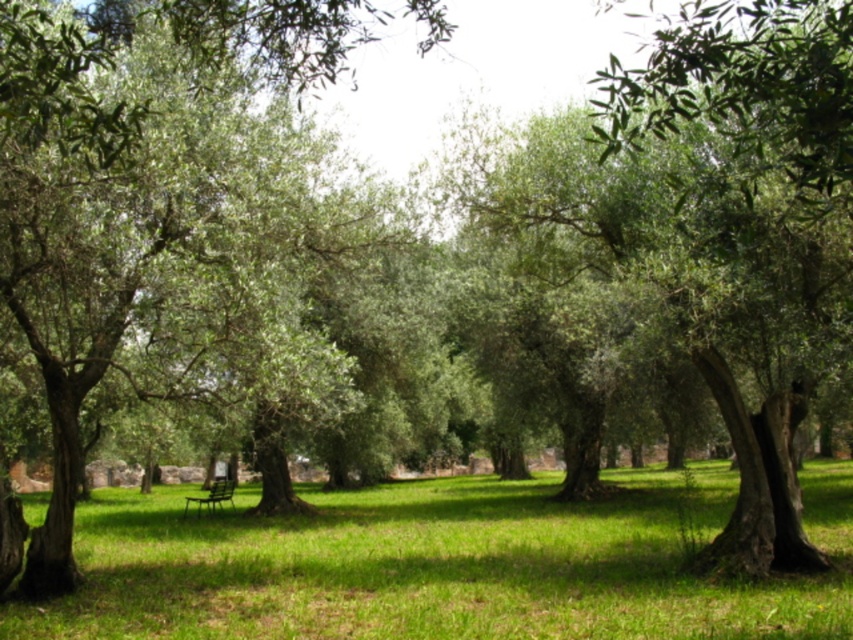
Question: Which object is closer to the camera taking this photo?

Choices:
 (A) green grassy field at center
 (B) metallic green bench at center

Answer: (A)

Question: Does green grassy field at center lie in front of metallic green bench at center?

Choices:
 (A) no
 (B) yes

Answer: (B)

Question: Among these points, which one is farthest from the camera?

Choices:
 (A) (625, 544)
 (B) (184, 500)

Answer: (B)

Question: Which of the following is the farthest from the observer?

Choices:
 (A) green grassy field at center
 (B) metallic green bench at center

Answer: (B)

Question: Is green grassy field at center to the left of metallic green bench at center from the viewer's perspective?

Choices:
 (A) no
 (B) yes

Answer: (A)

Question: Is green grassy field at center positioned at the back of metallic green bench at center?

Choices:
 (A) no
 (B) yes

Answer: (A)